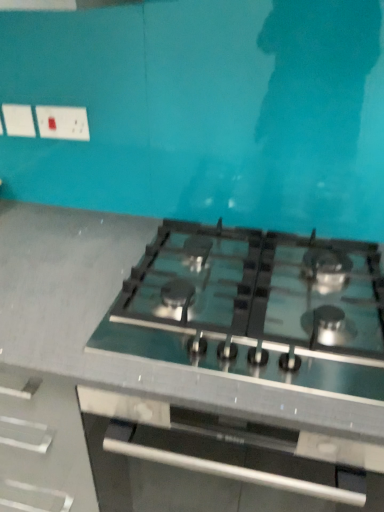
Question: Considering the positions of white plastic socket at upper left and green glass stove at center in the image, is white plastic socket at upper left wider or thinner than green glass stove at center?

Choices:
 (A) thin
 (B) wide

Answer: (A)

Question: Is white plastic socket at upper left taller or shorter than green glass stove at center?

Choices:
 (A) tall
 (B) short

Answer: (B)

Question: Based on their relative distances, which object is farther from the white plastic socket at upper left?

Choices:
 (A) green glass stove at center
 (B) satin black gas stove at center

Answer: (A)

Question: Which object is positioned closest to the green glass stove at center?

Choices:
 (A) white plastic socket at upper left
 (B) satin black gas stove at center

Answer: (B)